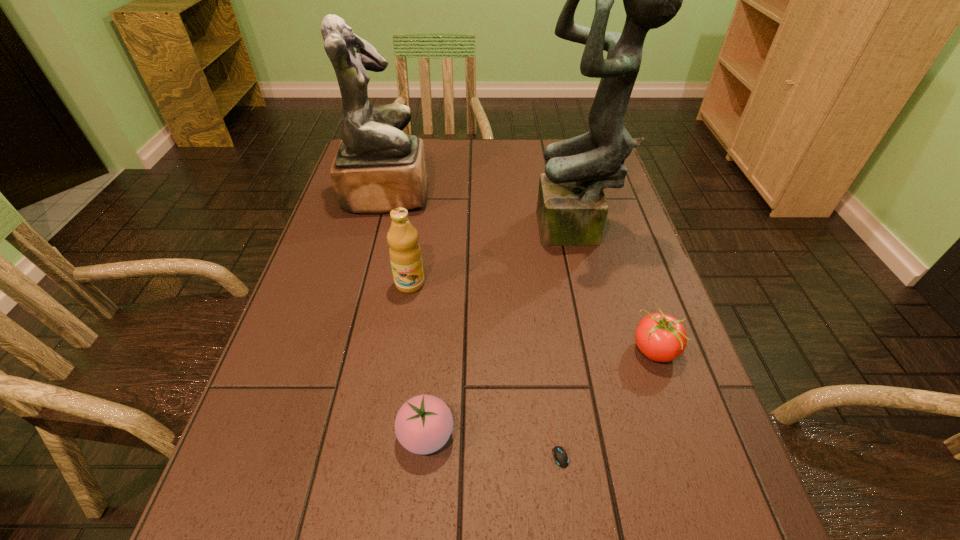
The image size is (960, 540). I want to click on free space that satisfies the following two spatial constraints: 1. in a relaxed pose on the second tallest object; 2. on the left side of the right tomato, so click(x=348, y=349).

In order to click on free space that satisfies the following two spatial constraints: 1. on the front side of the left tomato; 2. on the left side of the shortest object in this screenshot , I will do `click(425, 443)`.

At what (x,y) coordinates should I click in order to perform the action: click on free spot that satisfies the following two spatial constraints: 1. in a relaxed pose on the nearer tomato; 2. on the right side of the shorter sculpture. Please return your answer as a coordinate pair (x, y). Looking at the image, I should click on (324, 435).

Find the location of a particular element. free spot that satisfies the following two spatial constraints: 1. in a relaxed pose on the left sculpture; 2. on the left side of the mouse is located at coordinates (323, 443).

Where is `blank area in the image that satisfies the following two spatial constraints: 1. on the face of the right sculpture; 2. on the label of the olive oil`? The image size is (960, 540). blank area in the image that satisfies the following two spatial constraints: 1. on the face of the right sculpture; 2. on the label of the olive oil is located at coordinates (590, 284).

This screenshot has width=960, height=540. Identify the location of vacant point that satisfies the following two spatial constraints: 1. in a relaxed pose on the shorter sculpture; 2. on the back side of the fourth farthest object. (348, 349).

Identify the location of vacant space that satisfies the following two spatial constraints: 1. on the face of the taller sculpture; 2. on the right side of the fourth farthest object. (607, 349).